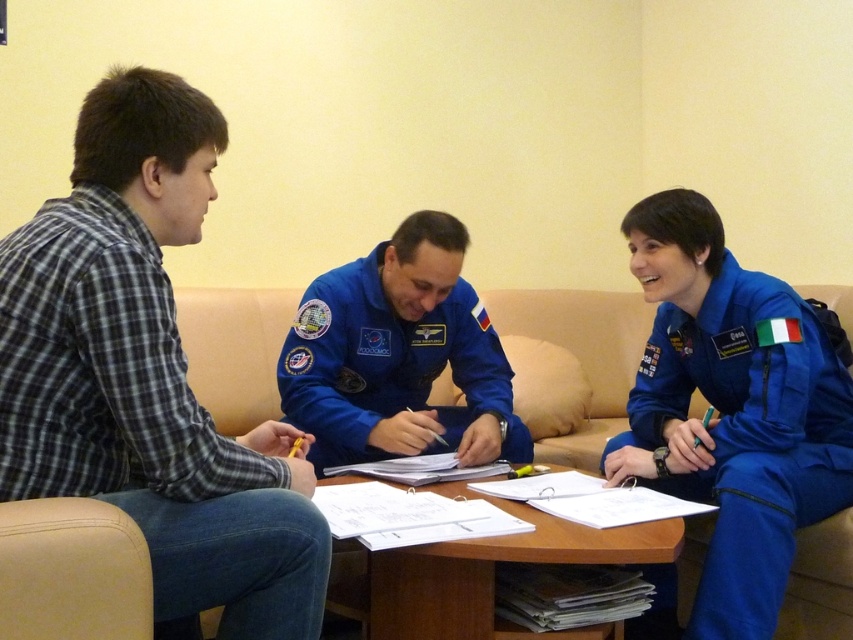
You are standing at the entrance of the room and want to approach the wooden table at center. Which direction should you walk to reach it first, passing by the blue fabric astronaut at center?

You should walk to the right because the blue fabric astronaut at center is to the left of the wooden table at center, so moving right would bring you closer to the table while passing the astronaut first.